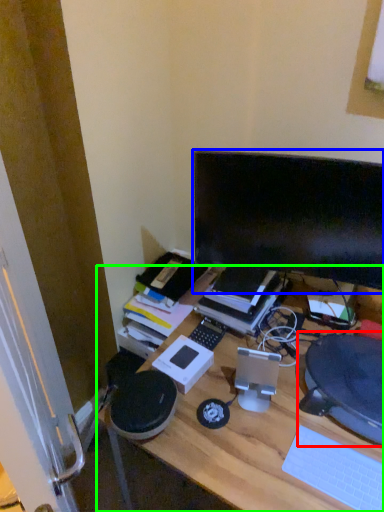
Question: Estimate the real-world distances between objects in this image. Which object is farther from computer chair (highlighted by a red box), computer monitor (highlighted by a blue box) or desk (highlighted by a green box)?

Choices:
 (A) computer monitor
 (B) desk

Answer: (A)